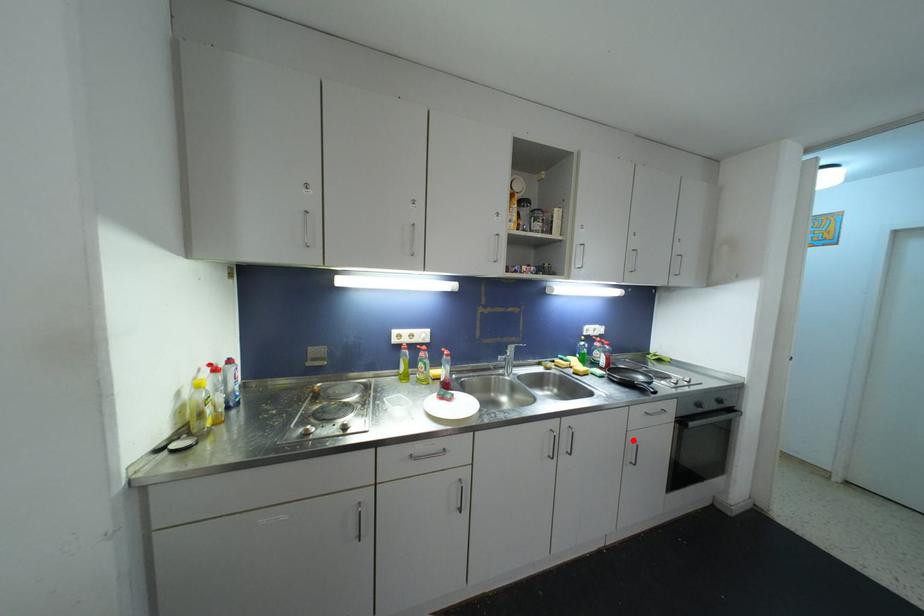
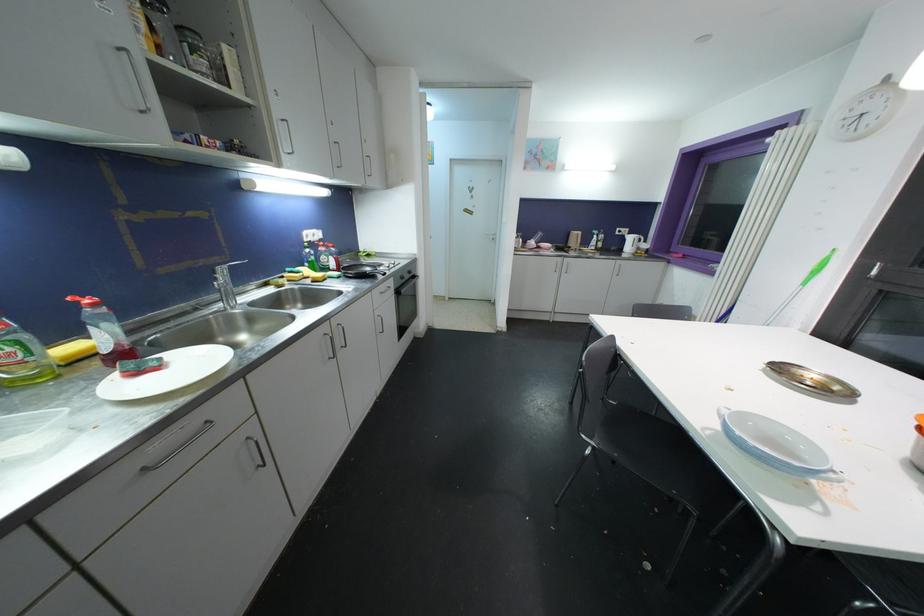
Locate, in the second image, the point that corresponds to the highlighted location in the first image.

(379, 318)